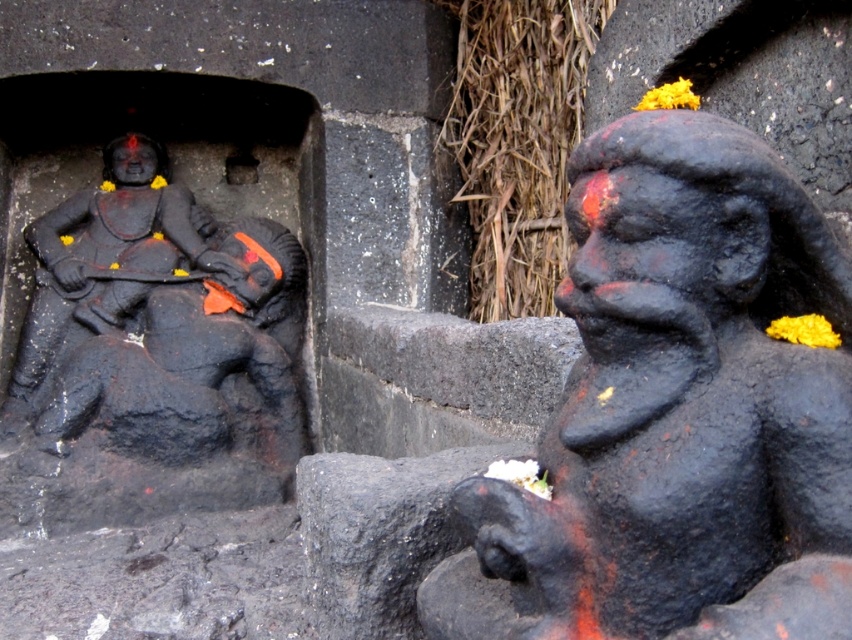
Where is `black stone monkey at right`? This screenshot has height=640, width=852. black stone monkey at right is located at coordinates (676, 412).

Identify the location of black stone monkey at right. Image resolution: width=852 pixels, height=640 pixels. (676, 412).